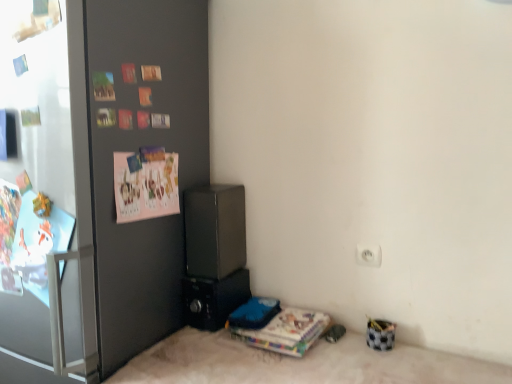
Question: Is pink paper postcard at upper left a part of white glossy refrigerator at left?

Choices:
 (A) yes
 (B) no

Answer: (A)

Question: Does white glossy refrigerator at left have a larger size compared to pink paper postcard at upper left?

Choices:
 (A) yes
 (B) no

Answer: (A)

Question: Considering the relative sizes of white glossy refrigerator at left and pink paper postcard at upper left in the image provided, is white glossy refrigerator at left taller than pink paper postcard at upper left?

Choices:
 (A) no
 (B) yes

Answer: (B)

Question: From a real-world perspective, is white glossy refrigerator at left over pink paper postcard at upper left?

Choices:
 (A) yes
 (B) no

Answer: (B)

Question: Is white glossy refrigerator at left wider than pink paper postcard at upper left?

Choices:
 (A) no
 (B) yes

Answer: (B)

Question: Would you say transparent glass door at left is to the left or to the right of satin black speaker at center, marked as the second appliance in a bottom-to-top arrangement, in the picture?

Choices:
 (A) right
 (B) left

Answer: (B)

Question: From the image's perspective, is transparent glass door at left above or below satin black speaker at center, the first appliance positioned from the top?

Choices:
 (A) below
 (B) above

Answer: (B)

Question: Is transparent glass door at left in front of or behind satin black speaker at center, marked as the second appliance in a bottom-to-top arrangement, in the image?

Choices:
 (A) front
 (B) behind

Answer: (A)

Question: Looking at their shapes, would you say transparent glass door at left is wider or thinner than satin black speaker at center, the first appliance positioned from the top?

Choices:
 (A) wide
 (B) thin

Answer: (B)

Question: From the image's perspective, is multicolored paper stack at lower center positioned above or below pink paper postcard at upper left?

Choices:
 (A) above
 (B) below

Answer: (B)

Question: Is multicolored paper stack at lower center to the left or to the right of pink paper postcard at upper left in the image?

Choices:
 (A) right
 (B) left

Answer: (A)

Question: Is multicolored paper stack at lower center in front of or behind pink paper postcard at upper left in the image?

Choices:
 (A) front
 (B) behind

Answer: (B)

Question: Is multicolored paper stack at lower center inside or outside of pink paper postcard at upper left?

Choices:
 (A) outside
 (B) inside

Answer: (A)

Question: Would you say black plastic speaker at lower center, which is the 2th appliance in top-to-bottom order, is to the left or to the right of multicolored paper stack at lower center in the picture?

Choices:
 (A) right
 (B) left

Answer: (B)

Question: Relative to multicolored paper stack at lower center, is black plastic speaker at lower center, which is the 2th appliance in top-to-bottom order, in front or behind?

Choices:
 (A) front
 (B) behind

Answer: (B)